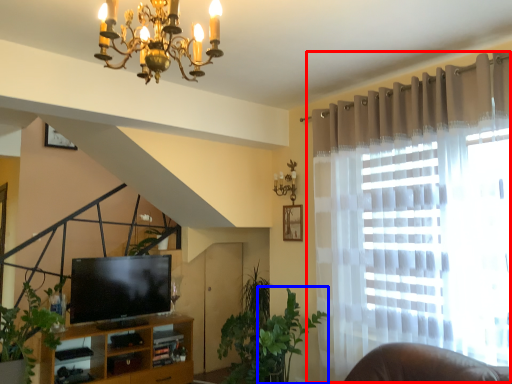
Question: Among these objects, which one is farthest to the camera, curtain (highlighted by a red box) or plant (highlighted by a blue box)?

Choices:
 (A) curtain
 (B) plant

Answer: (B)